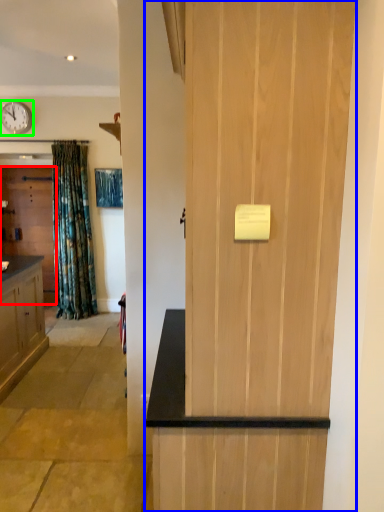
Question: Based on their relative distances, which object is nearer to door (highlighted by a red box)? Choose from door (highlighted by a blue box) and clock (highlighted by a green box).

Choices:
 (A) door
 (B) clock

Answer: (B)